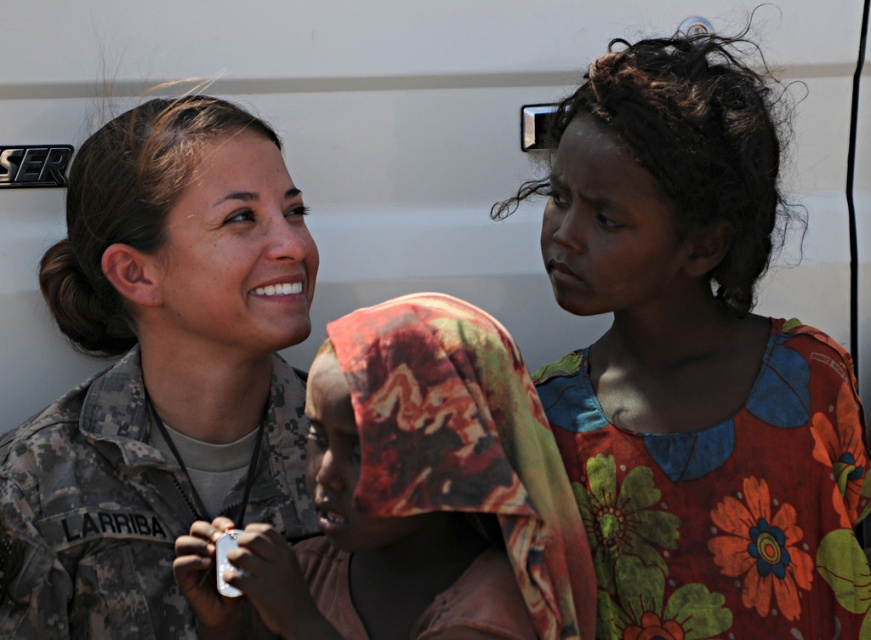
Where is `printed fabric headscarf at center`? Image resolution: width=871 pixels, height=640 pixels. printed fabric headscarf at center is located at coordinates coord(413,497).

Between printed fabric headscarf at center and floral printed fabric at upper right, which one is positioned lower?

printed fabric headscarf at center

Is point (441, 624) behind point (820, 588)?

No, (441, 624) is closer to viewer.

Locate an element on the screen. The width and height of the screenshot is (871, 640). printed fabric headscarf at center is located at coordinates (413, 497).

Between camouflage uniform at center and floral printed fabric at upper right, which one appears on the right side from the viewer's perspective?

From the viewer's perspective, floral printed fabric at upper right appears more on the right side.

Is point (292, 188) farther from camera compared to point (773, 506)?

Yes.

Locate an element on the screen. camouflage uniform at center is located at coordinates [159, 371].

Where is `floral fabric dress at center`? floral fabric dress at center is located at coordinates (694, 362).

Is floral fabric dress at center thinner than floral printed fabric at upper right?

Incorrect, floral fabric dress at center's width is not less than floral printed fabric at upper right's.

Between point (851, 580) and point (554, 372), which one is positioned in front?

Point (851, 580) is in front.

The height and width of the screenshot is (640, 871). Find the location of `floral fabric dress at center`. floral fabric dress at center is located at coordinates (694, 362).